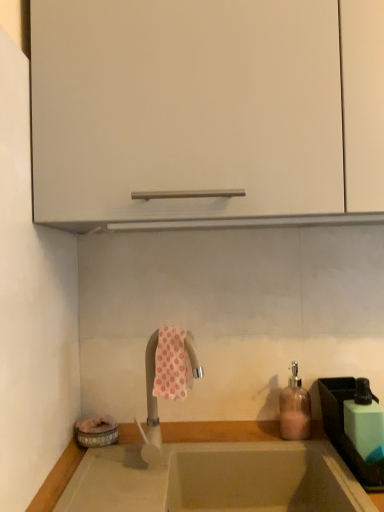
Question: Can you confirm if green plastic sink at lower right is thinner than pink floral fabric at center?

Choices:
 (A) no
 (B) yes

Answer: (A)

Question: Is green plastic sink at lower right bigger than pink floral fabric at center?

Choices:
 (A) yes
 (B) no

Answer: (A)

Question: From a real-world perspective, is green plastic sink at lower right located beneath pink floral fabric at center?

Choices:
 (A) no
 (B) yes

Answer: (B)

Question: Is green plastic sink at lower right with pink floral fabric at center?

Choices:
 (A) no
 (B) yes

Answer: (A)

Question: From the image's perspective, does green plastic sink at lower right appear higher than pink floral fabric at center?

Choices:
 (A) yes
 (B) no

Answer: (B)

Question: From the image's perspective, is smooth beige countertop at lower center above or below white matte cabinet at upper center?

Choices:
 (A) above
 (B) below

Answer: (B)

Question: Looking at their shapes, would you say smooth beige countertop at lower center is wider or thinner than white matte cabinet at upper center?

Choices:
 (A) wide
 (B) thin

Answer: (B)

Question: Is smooth beige countertop at lower center bigger or smaller than white matte cabinet at upper center?

Choices:
 (A) big
 (B) small

Answer: (B)

Question: Considering the positions of smooth beige countertop at lower center and white matte cabinet at upper center in the image, is smooth beige countertop at lower center taller or shorter than white matte cabinet at upper center?

Choices:
 (A) tall
 (B) short

Answer: (B)

Question: Considering the relative positions of pink floral fabric at center and green plastic sink at lower right in the image provided, is pink floral fabric at center to the left or to the right of green plastic sink at lower right?

Choices:
 (A) left
 (B) right

Answer: (A)

Question: Looking at the image, does pink floral fabric at center seem bigger or smaller compared to green plastic sink at lower right?

Choices:
 (A) small
 (B) big

Answer: (A)

Question: Considering their positions, is pink floral fabric at center located in front of or behind green plastic sink at lower right?

Choices:
 (A) behind
 (B) front

Answer: (A)

Question: Is pink floral fabric at center situated inside green plastic sink at lower right or outside?

Choices:
 (A) outside
 (B) inside

Answer: (A)

Question: Relative to smooth beige countertop at lower center, is green matte soap dispenser at right in front or behind?

Choices:
 (A) front
 (B) behind

Answer: (B)

Question: Based on their sizes in the image, would you say green matte soap dispenser at right is bigger or smaller than smooth beige countertop at lower center?

Choices:
 (A) small
 (B) big

Answer: (A)